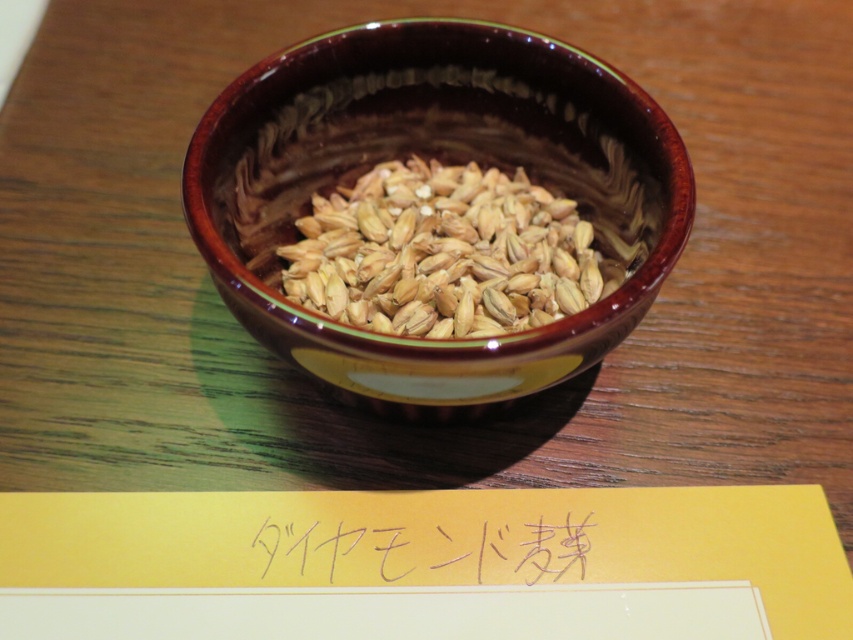
Does brown glossy bowl at center have a larger size compared to handwritten paper at center?

Indeed, brown glossy bowl at center has a larger size compared to handwritten paper at center.

Is point (590, 202) closer to viewer compared to point (396, 550)?

No.

Locate an element on the screen. Image resolution: width=853 pixels, height=640 pixels. brown glossy bowl at center is located at coordinates pos(440,157).

Is brown glossy bowl at center in front of brown matte grains at center?

Yes, it is in front of brown matte grains at center.

This screenshot has height=640, width=853. Describe the element at coordinates (440, 157) in the screenshot. I see `brown glossy bowl at center` at that location.

You are a GUI agent. You are given a task and a screenshot of the screen. Output one action in this format:
    pyautogui.click(x=<x>, y=<y>)
    Task: Click on the brown glossy bowl at center
    Image resolution: width=853 pixels, height=640 pixels.
    Given the screenshot: What is the action you would take?
    pyautogui.click(x=440, y=157)

Is brown matte grains at center to the left of handwritten paper at center from the viewer's perspective?

In fact, brown matte grains at center is to the right of handwritten paper at center.

Between brown matte grains at center and handwritten paper at center, which one is positioned higher?

brown matte grains at center is above.

What do you see at coordinates (445, 253) in the screenshot?
I see `brown matte grains at center` at bounding box center [445, 253].

Locate an element on the screen. The width and height of the screenshot is (853, 640). brown matte grains at center is located at coordinates (445, 253).